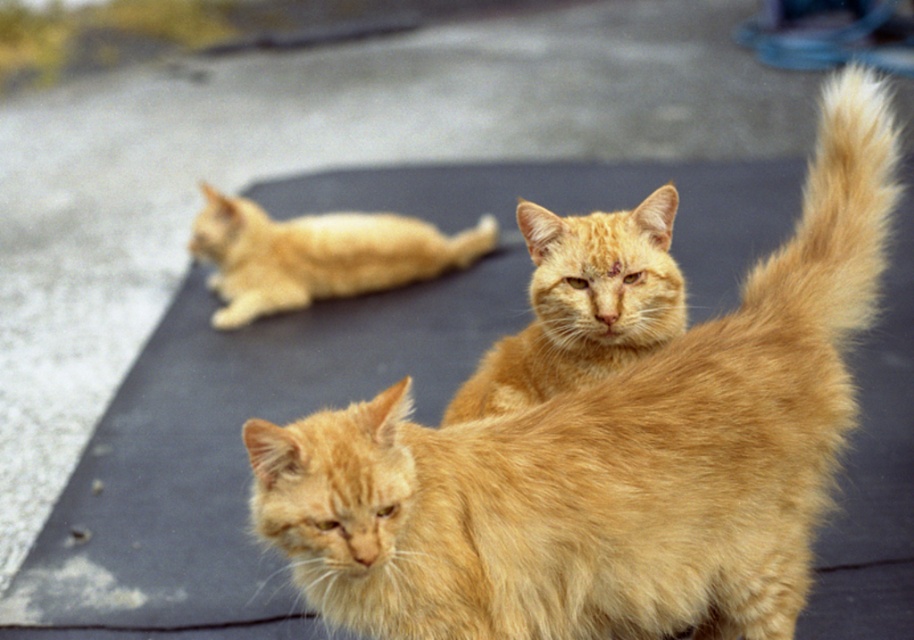
Question: Which point appears farthest from the camera in this image?

Choices:
 (A) (372, 253)
 (B) (630, 609)
 (C) (836, 188)

Answer: (A)

Question: Does fluffy orange cat at center have a lesser width compared to orange fur cat at center?

Choices:
 (A) yes
 (B) no

Answer: (B)

Question: Which is nearer to the orange fur cat at center?

Choices:
 (A) blonde fur cat at upper left
 (B) fluffy golden tail at upper right
 (C) fluffy orange cat at center

Answer: (C)

Question: Which point is closer to the camera?

Choices:
 (A) (622, 236)
 (B) (369, 285)
 (C) (803, 204)

Answer: (A)

Question: Considering the relative positions of fluffy golden tail at upper right and blonde fur cat at upper left in the image provided, where is fluffy golden tail at upper right located with respect to blonde fur cat at upper left?

Choices:
 (A) right
 (B) left

Answer: (A)

Question: Does orange fur cat at center have a larger size compared to blonde fur cat at upper left?

Choices:
 (A) yes
 (B) no

Answer: (B)